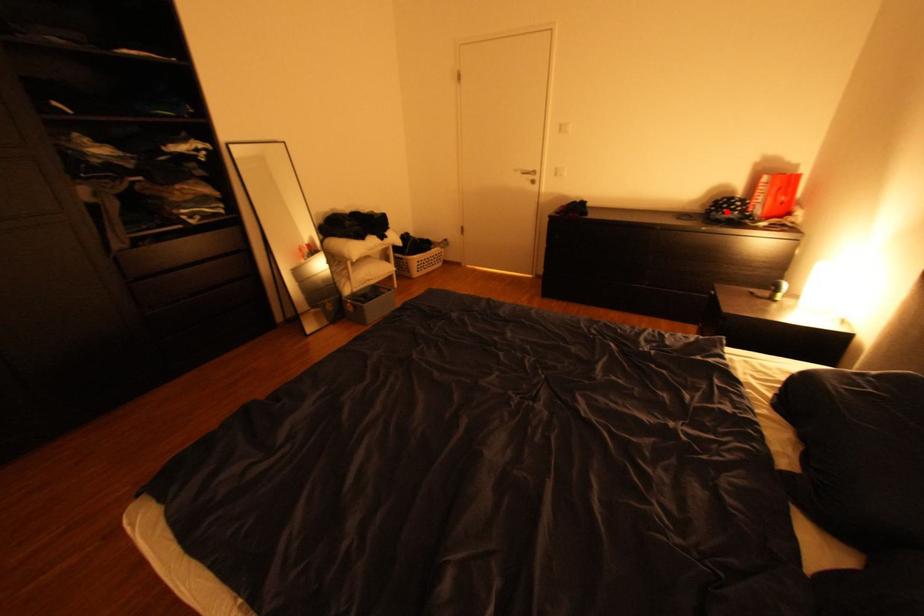
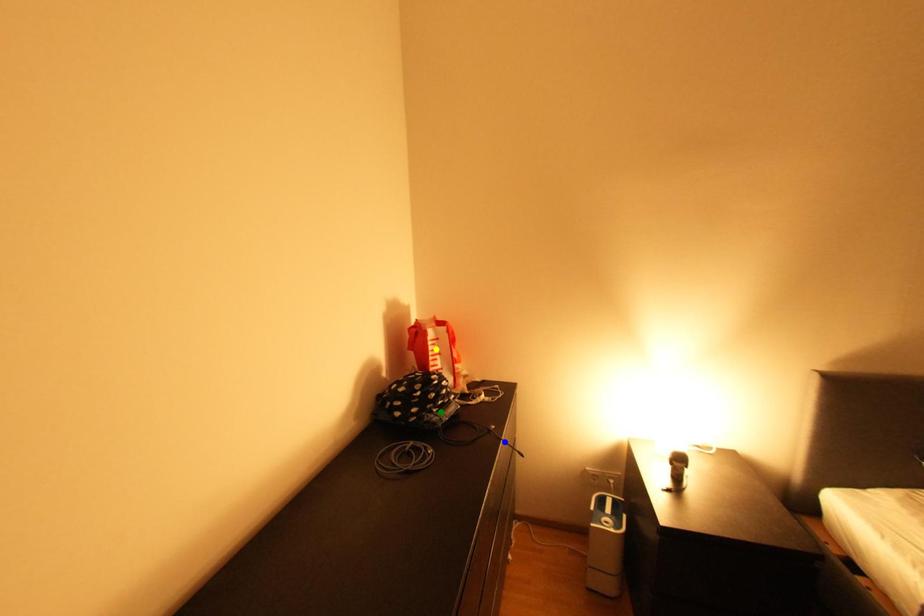
Question: I am providing you with two images of the same scene from different viewpoints. A red point is marked on the first image. You are given multiple points on the second image. Which spot in image 2 lines up with the point in image 1?

Choices:
 (A) blue point
 (B) yellow point
 (C) green point

Answer: (C)